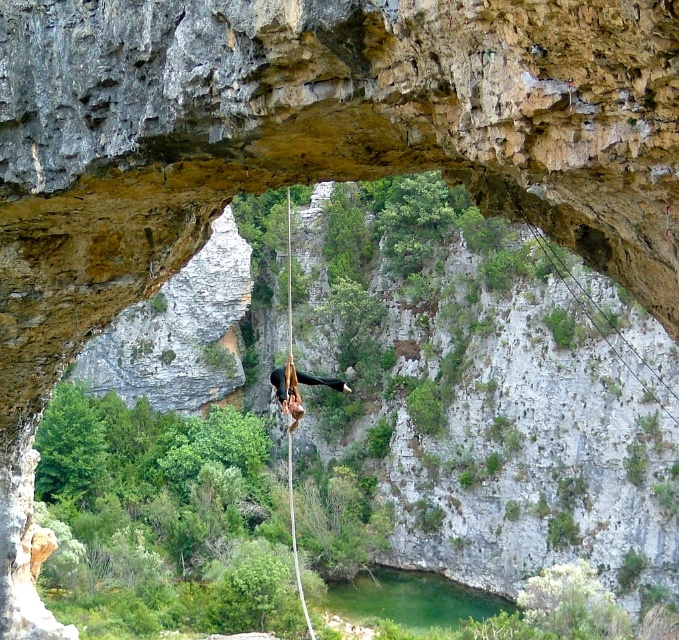
In the scene shown: You are a photographer trying to capture the slackliner through the rock arch. You notice two points marked in the image. Which point, point (291, 513) or point (295, 381), is closer to the camera and should be focused on to ensure the slackliner is in sharp focus?

Point (295, 381) is closer to the camera since point (291, 513) is behind it, so focusing on point (295, 381) will ensure the slackliner is in sharp focus.